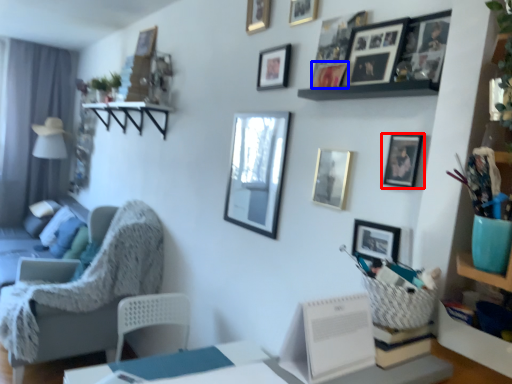
Question: Among these objects, which one is farthest to the camera, picture frame (highlighted by a red box) or picture frame (highlighted by a blue box)?

Choices:
 (A) picture frame
 (B) picture frame

Answer: (B)